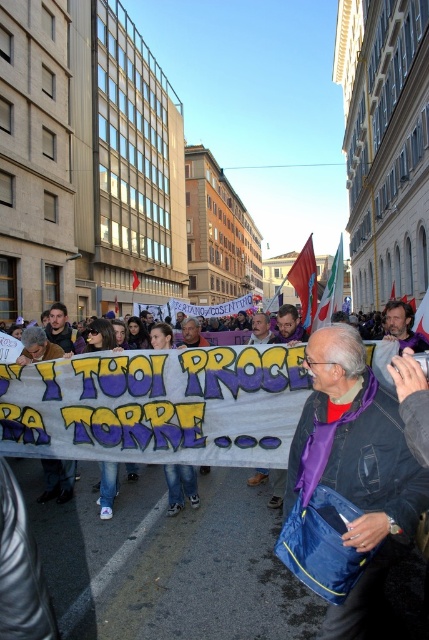
Question: From the image, what is the correct spatial relationship of red fabric flag at center in relation to white fabric flag at center?

Choices:
 (A) left
 (B) right

Answer: (A)

Question: Which is nearer to the purple fabric bag at center?

Choices:
 (A) white fabric flag at center
 (B) red fabric flag at center

Answer: (B)

Question: Considering the relative positions of red fabric flag at center and white fabric flag at center in the image provided, where is red fabric flag at center located with respect to white fabric flag at center?

Choices:
 (A) left
 (B) right

Answer: (A)

Question: Can you confirm if red fabric flag at center is positioned to the right of white fabric flag at center?

Choices:
 (A) no
 (B) yes

Answer: (A)

Question: Which object is the farthest from the white fabric flag at center?

Choices:
 (A) red fabric flag at center
 (B) purple fabric bag at center

Answer: (A)

Question: Which of the following is the closest to the observer?

Choices:
 (A) white fabric flag at center
 (B) purple fabric bag at center
 (C) red fabric flag at center

Answer: (B)